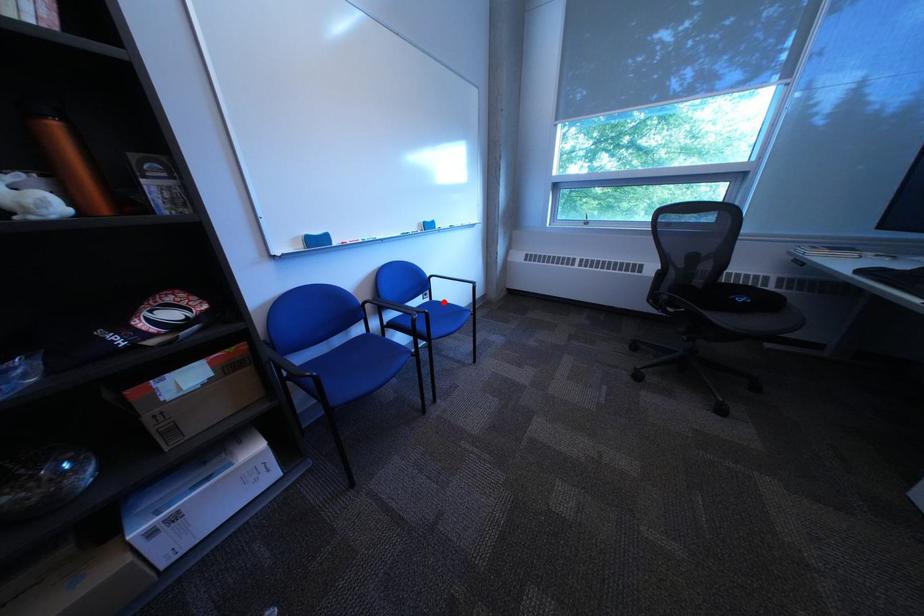
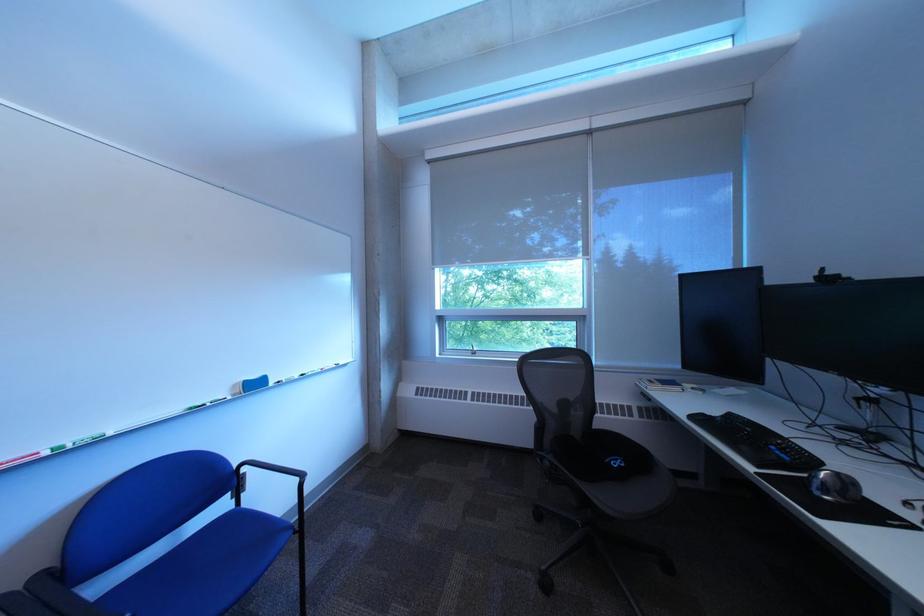
The point at the highlighted location is marked in the first image. Where is the corresponding point in the second image?

(248, 508)